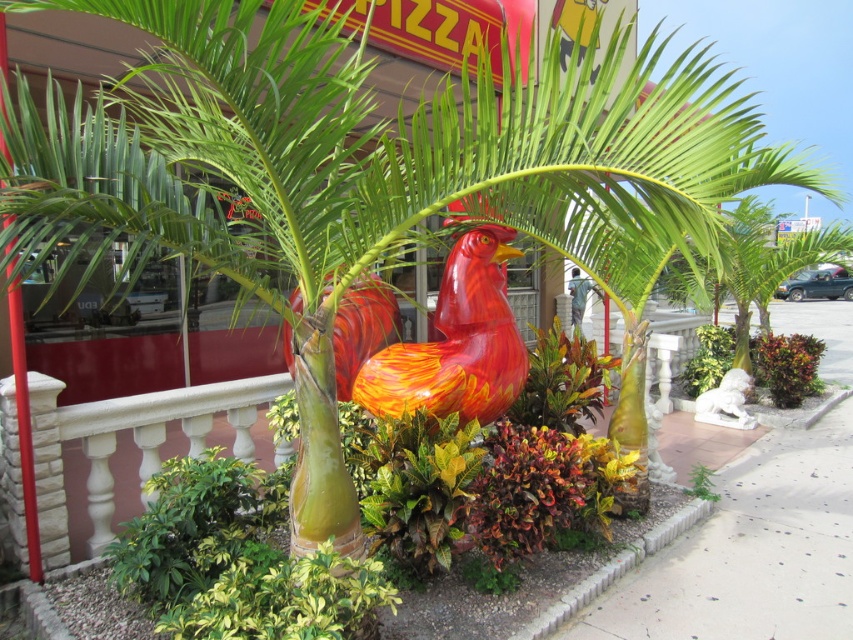
Can you confirm if shiny red and orange rooster at center is bigger than brick at lower right?

Correct, shiny red and orange rooster at center is larger in size than brick at lower right.

Between shiny red and orange rooster at center and brick at lower right, which one has more height?

shiny red and orange rooster at center is taller.

Does point (376, 372) come behind point (627, 566)?

No, (376, 372) is closer to viewer.

The width and height of the screenshot is (853, 640). What are the coordinates of `shiny red and orange rooster at center` in the screenshot? It's located at (456, 342).

Can you confirm if shiny red and orange rooster at center is positioned below shiny orange bird at center?

Yes, shiny red and orange rooster at center is below shiny orange bird at center.

Does shiny red and orange rooster at center appear over shiny orange bird at center?

No.

Between point (368, 387) and point (283, 324), which one is positioned behind?

The point (283, 324) is more distant.

Locate an element on the screen. This screenshot has width=853, height=640. shiny red and orange rooster at center is located at coordinates (456, 342).

Can you confirm if shiny orange bird at center is positioned to the left of brick at lower right?

Indeed, shiny orange bird at center is positioned on the left side of brick at lower right.

Measure the distance between shiny orange bird at center and brick at lower right.

shiny orange bird at center is 5.64 feet from brick at lower right.

Who is more distant from viewer, (x=358, y=348) or (x=613, y=556)?

The point (x=358, y=348) is behind.

Where is `shiny orange bird at center`? This screenshot has width=853, height=640. shiny orange bird at center is located at coordinates (363, 328).